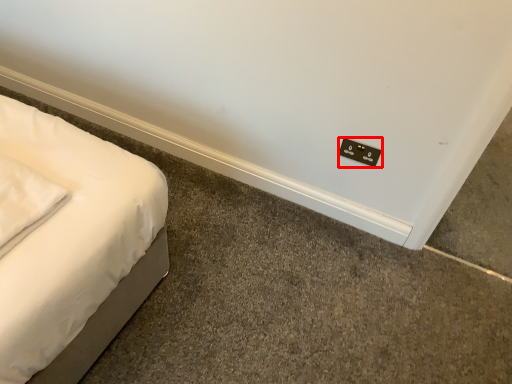
Question: From the image's perspective, where is electric outlet (annotated by the red box) located relative to pillow?

Choices:
 (A) above
 (B) below

Answer: (A)